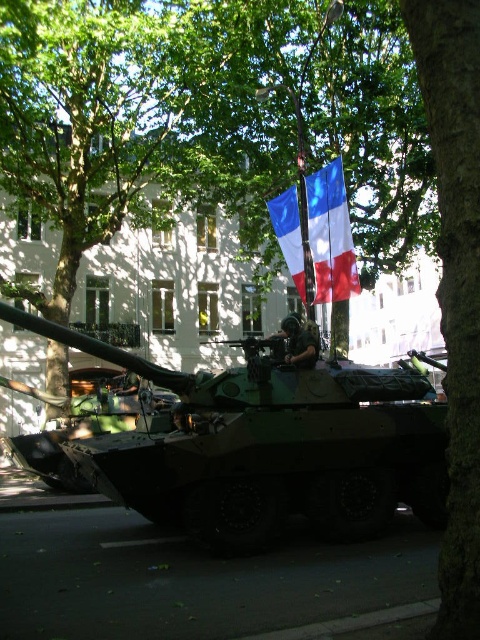
Question: Is camouflage fabric tank at center closer to the viewer compared to green rough bark tree at center?

Choices:
 (A) no
 (B) yes

Answer: (A)

Question: Is camouflage fabric tank at center above green rough bark tree at center?

Choices:
 (A) yes
 (B) no

Answer: (A)

Question: Which point appears farthest from the camera in this image?

Choices:
 (A) (430, 138)
 (B) (291, 244)
 (C) (351, 516)

Answer: (B)

Question: Which point is closer to the camera taking this photo?

Choices:
 (A) (385, 394)
 (B) (454, 532)
 (C) (292, 208)

Answer: (B)

Question: Is camouflage fabric tank at center to the left of green rough bark tree at center from the viewer's perspective?

Choices:
 (A) yes
 (B) no

Answer: (A)

Question: Based on their relative distances, which object is nearer to the blue fabric flag at center?

Choices:
 (A) camouflage fabric tank at center
 (B) green rough bark tree at center

Answer: (A)